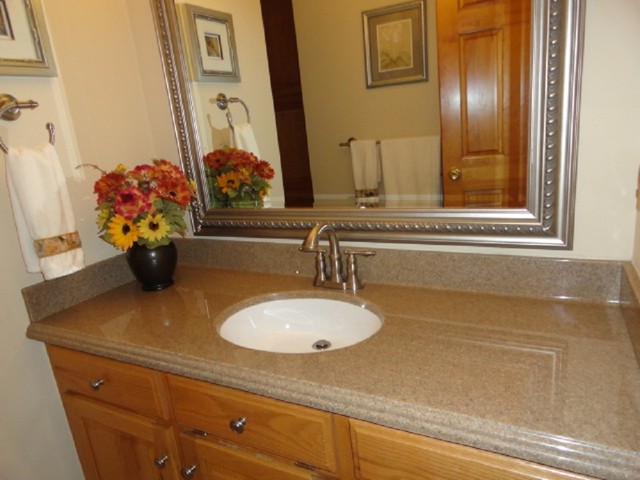
At what (x,y) coordinates should I click in order to perform the action: click on white towel. Please return your answer as a coordinate pair (x, y). Looking at the image, I should click on (52, 205).